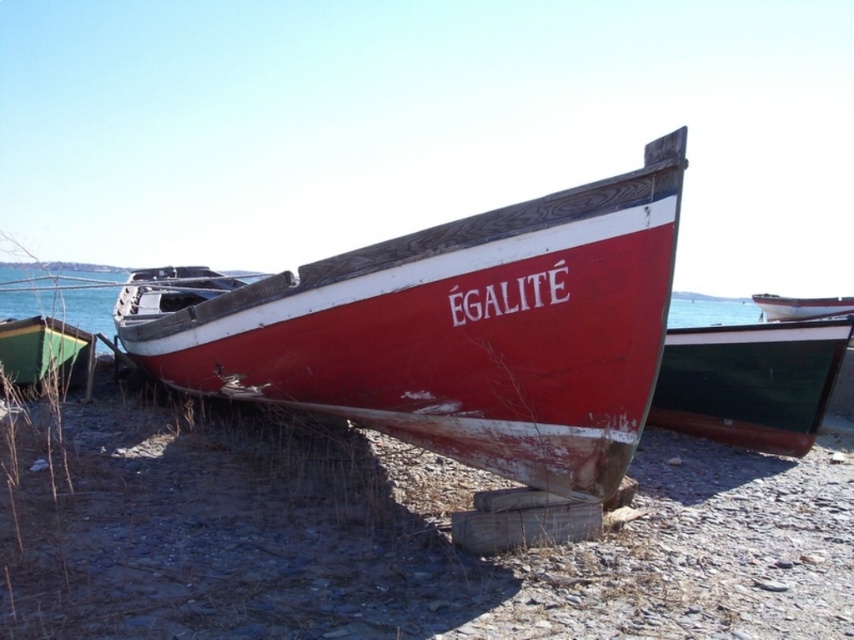
You are a dock worker who needs to move the green matte boat at lower left and the white glossy boat at right. Based on their positions and the space available, which boat would require more space to maneuver around the rocky shore?

The green matte boat at lower left might require more space to maneuver around the rocky shore since it might be wider than the white glossy boat at right.

You are a photographer planning to take a photo of the green matte boat at lower left and the white glossy boat at right. Since you want both boats to appear the same size in the photo, which boat should you move closer to and which should you move farther away?

The green matte boat at lower left is bigger than the white glossy boat at right. To make them appear the same size in the photo, move the green matte boat at lower left farther away and bring the white glossy boat at right closer.